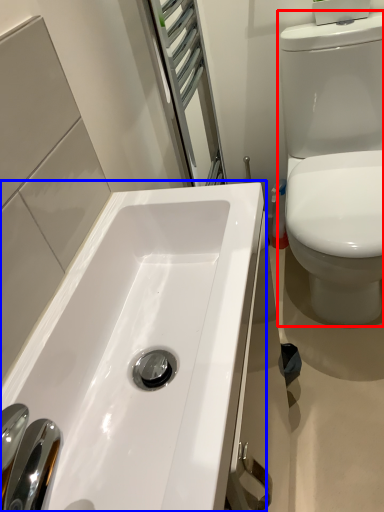
Question: Which point is further to the camera, toilet (highlighted by a red box) or sink (highlighted by a blue box)?

Choices:
 (A) toilet
 (B) sink

Answer: (A)